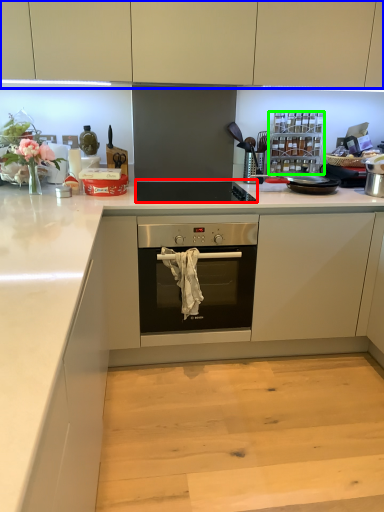
Question: Which object is the farthest from gas stove (highlighted by a red box)? Choose among these: cabinetry (highlighted by a blue box) or appliance (highlighted by a green box).

Choices:
 (A) cabinetry
 (B) appliance

Answer: (A)